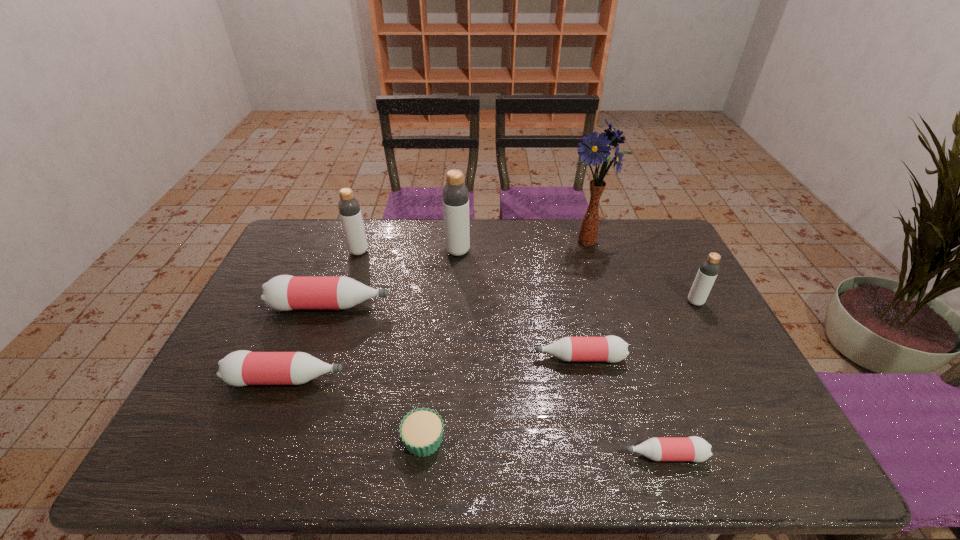
Image resolution: width=960 pixels, height=540 pixels. Identify the location of free space located 0.050m on the left of the fourth tallest object. [670, 302].

The width and height of the screenshot is (960, 540). I want to click on free region located 0.100m with the cap open on the fifth tallest object, so click(423, 306).

At what (x,y) coordinates should I click in order to perform the action: click on free spot located with the cap open on the second biggest pink bottle. Please return your answer as a coordinate pair (x, y). The width and height of the screenshot is (960, 540). Looking at the image, I should click on (393, 379).

This screenshot has width=960, height=540. Identify the location of vacant area located 0.050m with the cap open on the sixth tallest bottle. (516, 357).

Identify the location of vacant region located 0.310m with the cap open on the sixth tallest bottle. (418, 357).

Find the location of `vacant space located 0.350m with the cap open on the sixth tallest bottle`. vacant space located 0.350m with the cap open on the sixth tallest bottle is located at coordinates (402, 357).

Where is `free space located on the back of the cupcake`? The width and height of the screenshot is (960, 540). free space located on the back of the cupcake is located at coordinates (429, 387).

This screenshot has width=960, height=540. What are the coordinates of `vacant space located with the cap open on the nearest pink bottle` in the screenshot? It's located at (442, 455).

Find the location of a particular element. The height and width of the screenshot is (540, 960). free space located with the cap open on the nearest pink bottle is located at coordinates (465, 455).

The width and height of the screenshot is (960, 540). Identify the location of free location located with the cap open on the nearest pink bottle. (524, 455).